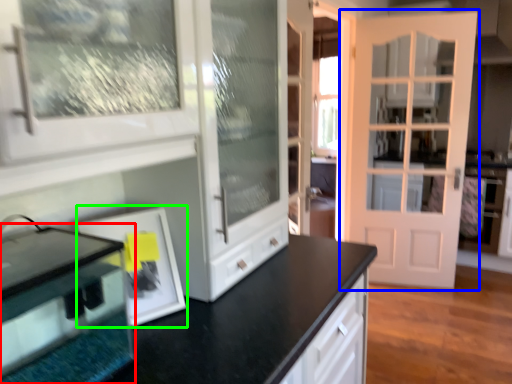
Question: Which is farther away from appliance (highlighted by a red box)? door (highlighted by a blue box) or picture frame (highlighted by a green box)?

Choices:
 (A) door
 (B) picture frame

Answer: (A)